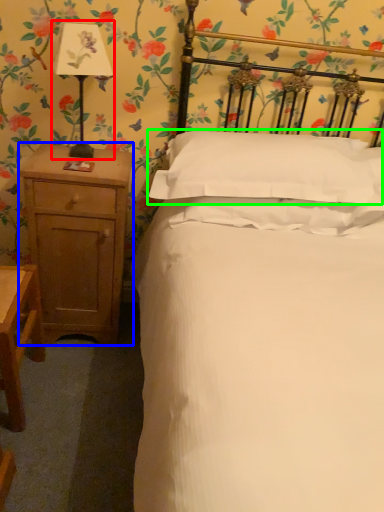
Question: Which object is the closest to the bedside lamp (highlighted by a red box)? Choose among these: nightstand (highlighted by a blue box) or pillow (highlighted by a green box).

Choices:
 (A) nightstand
 (B) pillow

Answer: (A)